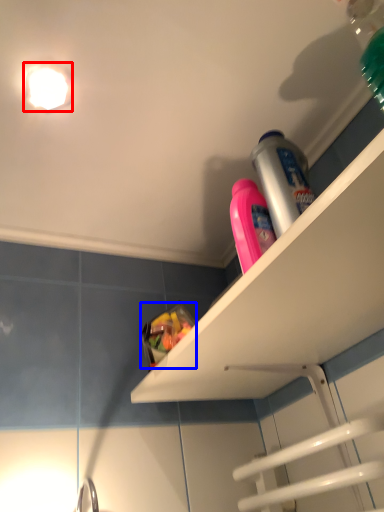
Question: Which point is closer to the camera, light fixture (highlighted by a red box) or food (highlighted by a blue box)?

Choices:
 (A) light fixture
 (B) food

Answer: (A)